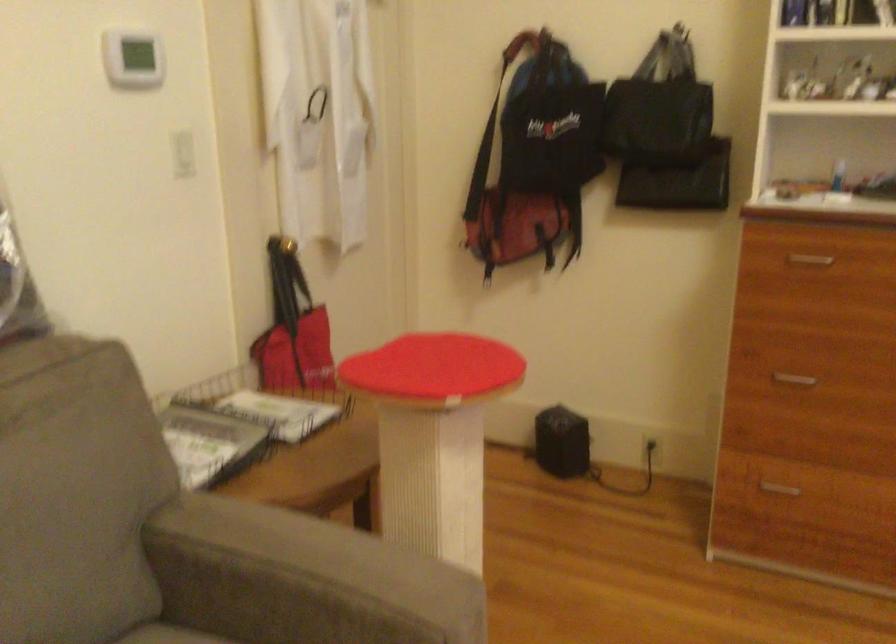
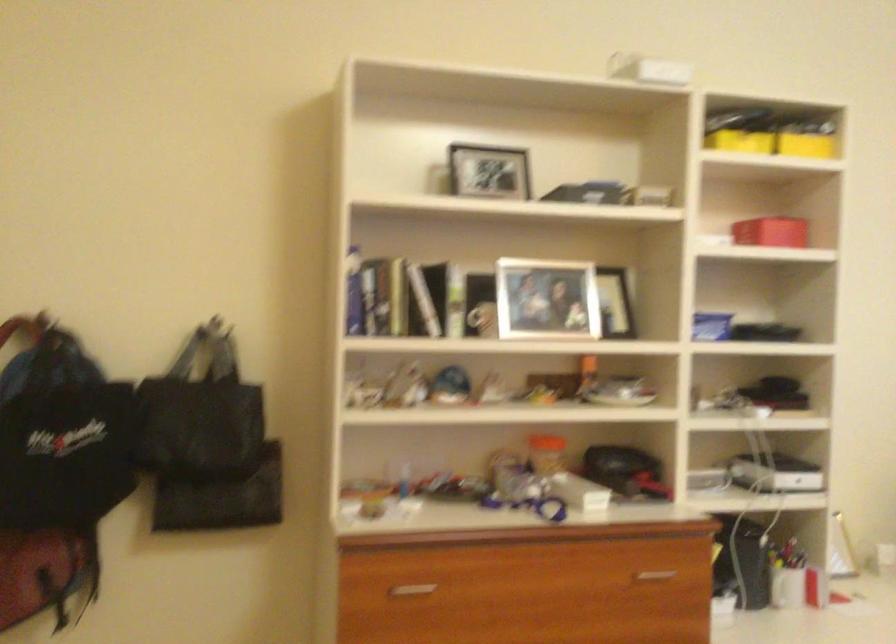
Question: The first image is from the beginning of the video and the second image is from the end. How did the camera likely rotate when shooting the video?

Choices:
 (A) Left
 (B) Right
 (C) Up
 (D) Down

Answer: (B)